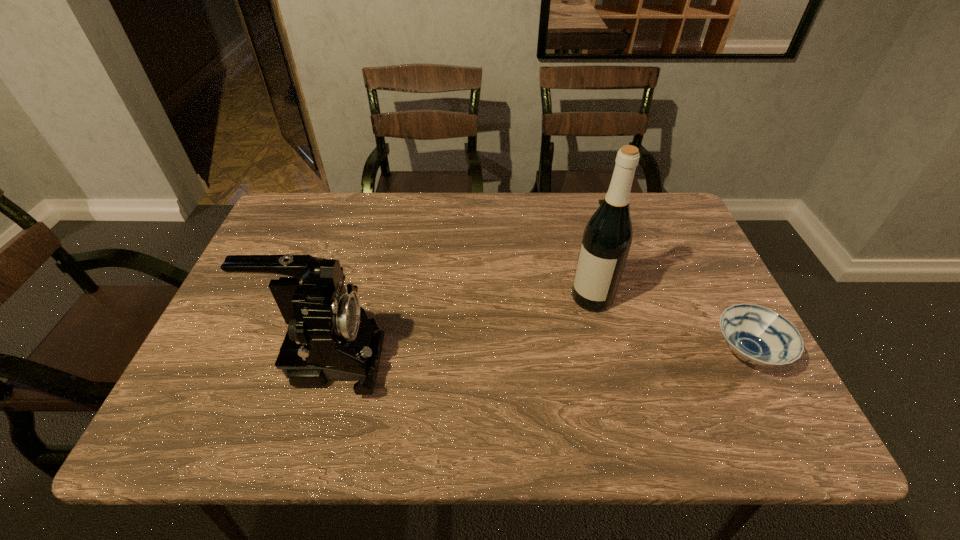
Identify the location of vacant space located in front of the lenses of the sunglasses. The width and height of the screenshot is (960, 540). (598, 240).

I want to click on vacant space located on the label of the wine bottle, so click(556, 341).

Identify the location of vacant point located 0.230m on the label of the wine bottle. (530, 373).

This screenshot has height=540, width=960. Identify the location of free spot located on the label of the wine bottle. (527, 376).

What are the coordinates of `object that is at the far edge` in the screenshot? It's located at (600, 200).

Image resolution: width=960 pixels, height=540 pixels. Identify the location of camcorder that is at the near edge. (330, 338).

Image resolution: width=960 pixels, height=540 pixels. Identify the location of soup bowl situated at the near edge. (758, 335).

Identify the location of object present at the left edge. (330, 338).

You are a GUI agent. You are given a task and a screenshot of the screen. Output one action in this format:
    pyautogui.click(x=<x>, y=<y>)
    Task: Click on the soup bowl that is at the right edge
    
    Given the screenshot: What is the action you would take?
    pyautogui.click(x=758, y=335)

Where is `sunglasses present at the right edge`? Image resolution: width=960 pixels, height=540 pixels. sunglasses present at the right edge is located at coordinates (600, 200).